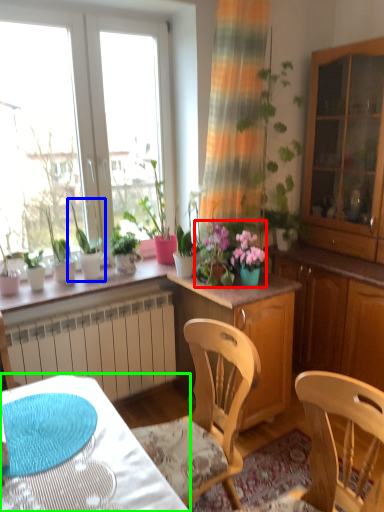
Question: Which object is the farthest from floral arrangement (highlighted by a red box)? Choose among these: houseplant (highlighted by a blue box) or desk (highlighted by a green box).

Choices:
 (A) houseplant
 (B) desk

Answer: (B)